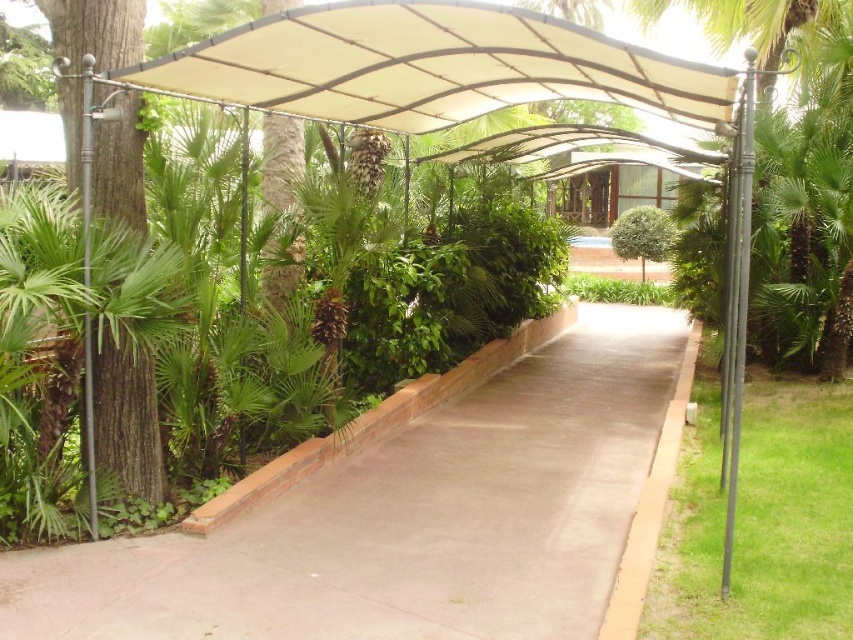
Looking at this image, you are a delivery person carrying a heavy box and need to step onto the concrete at center to avoid the muddy ground. Can you safely step onto it without hitting your head on the brown rough tree at left?

The concrete at center has a lesser height compared to the brown rough tree at left, so stepping onto it won not hit your head since the tree is taller.

You are a photographer holding a camera. You want to take a photo of the concrete at center from a distance of 10 feet. Can you position yourself closer to the camera to achieve this?

The concrete at center and camera are 12.57 feet apart from each other. To take the photo from 10 feet away, you need to move 2.57 feet closer to the camera.

Based on the photo, you are a gardener planning to place a new bench on the pathway. The bench requires a flat area larger than the brown rough tree at left. Can the concrete at center accommodate the bench?

The concrete at center is larger in size than the brown rough tree at left, so yes, the concrete at center can accommodate the bench since it has sufficient space.